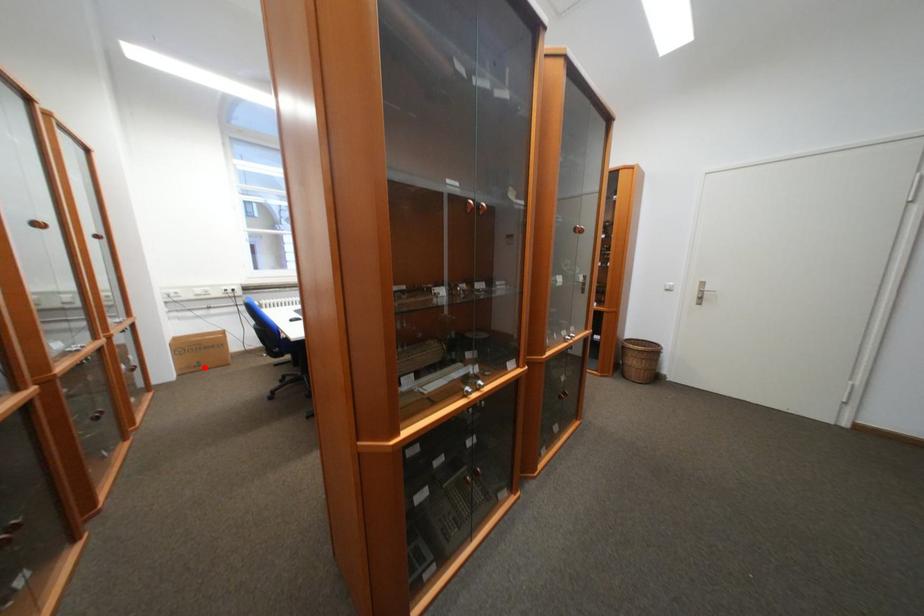
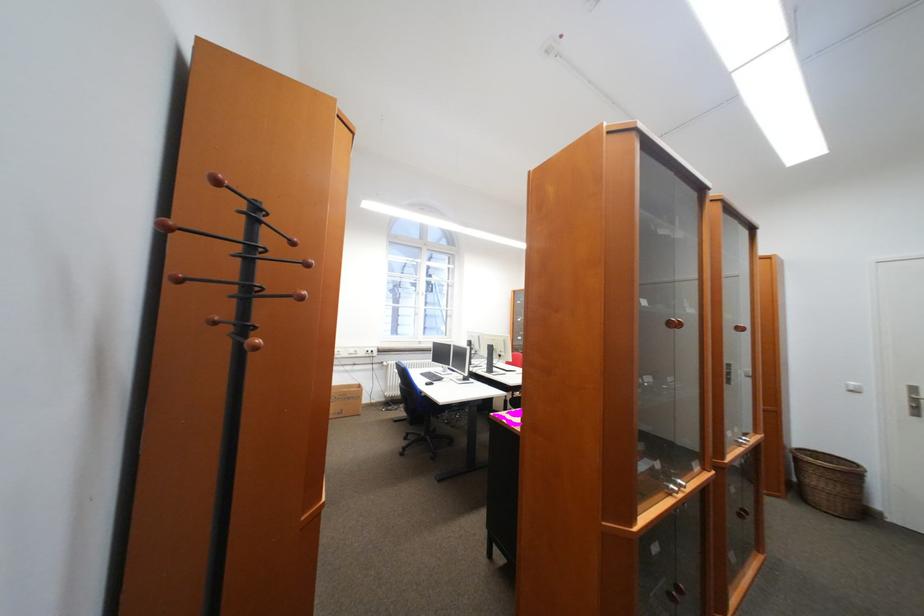
Question: I am providing you with two images of the same scene from different viewpoints. Image1 has a red point marked. In image2, the corresponding 3D location appears at what relative position? Reply with the corresponding letter.

Choices:
 (A) Closer
 (B) Farther

Answer: (B)